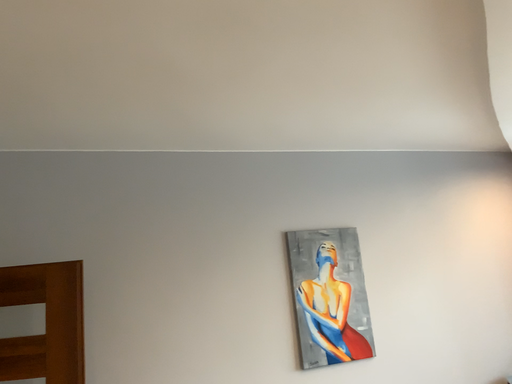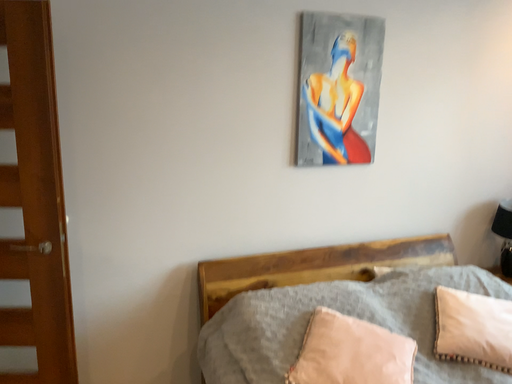
Question: Which way did the camera rotate in the video?

Choices:
 (A) rotated upward
 (B) rotated downward

Answer: (B)